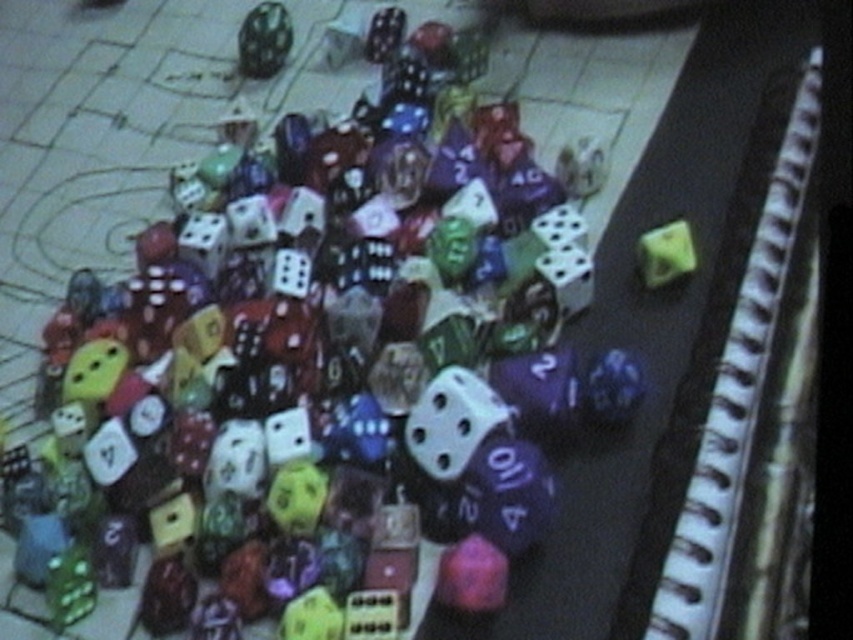
Does matte black dice at upper center have a lesser height compared to matte green die at upper right?

In fact, matte black dice at upper center may be taller than matte green die at upper right.

Is point (252, 44) more distant than point (643, 240)?

Yes, point (252, 44) is farther from viewer.

Locate an element on the screen. matte black dice at upper center is located at coordinates (264, 38).